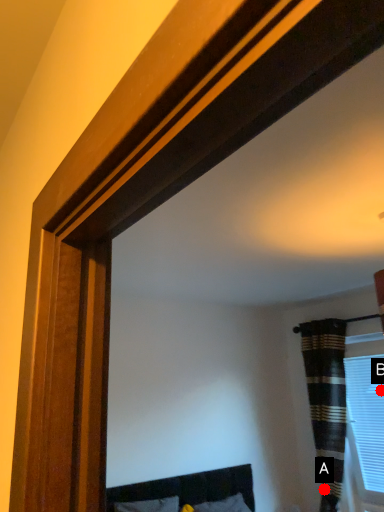
Question: Two points are circled on the image, labeled by A and B beside each circle. Which point is closer to the camera?

Choices:
 (A) A is closer
 (B) B is closer

Answer: (B)